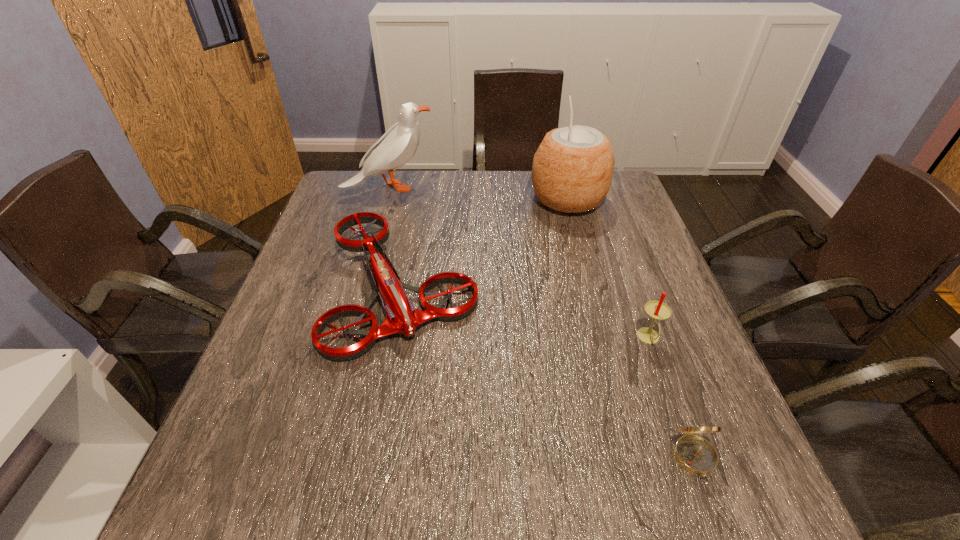
This screenshot has width=960, height=540. I want to click on coconut, so click(572, 170).

Image resolution: width=960 pixels, height=540 pixels. I want to click on gull, so click(398, 145).

The width and height of the screenshot is (960, 540). Identify the location of candle. [657, 310].

Image resolution: width=960 pixels, height=540 pixels. In order to click on drone in this screenshot , I will do `click(401, 316)`.

The height and width of the screenshot is (540, 960). I want to click on the nearest object, so click(x=696, y=455).

Find the location of a particular element. vacant space located on the left of the coconut is located at coordinates (399, 199).

In order to click on free region located 0.130m at the beak of the gull in this screenshot , I will do `click(475, 187)`.

You are a GUI agent. You are given a task and a screenshot of the screen. Output one action in this format:
    pyautogui.click(x=<x>, y=<y>)
    Task: Click on the free space located 0.120m on the front of the third tallest object
    This screenshot has width=960, height=540.
    Given the screenshot: What is the action you would take?
    pyautogui.click(x=671, y=401)

This screenshot has width=960, height=540. I want to click on free spot located 0.300m on the front of the drone, so click(x=360, y=521).

The width and height of the screenshot is (960, 540). I want to click on blank area located 0.060m with the dial facing the nearest object, so click(x=718, y=524).